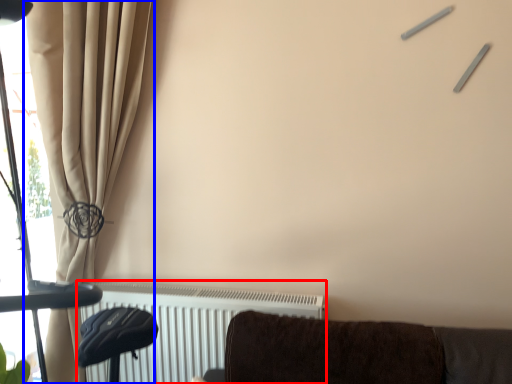
Question: Which of the following is the farthest to the observer, radiator (highlighted by a red box) or curtain (highlighted by a blue box)?

Choices:
 (A) radiator
 (B) curtain

Answer: (A)